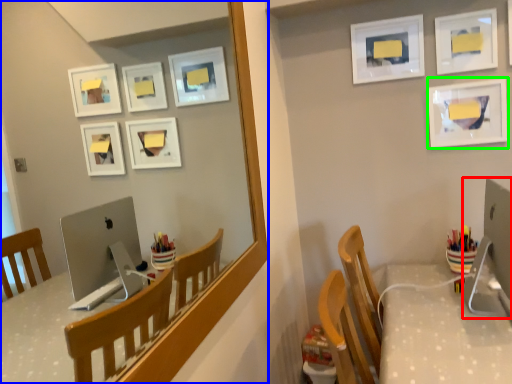
Question: Based on their relative distances, which object is farther from desktop computer (highlighted by a red box)? Choose from mirror (highlighted by a blue box) and picture frame (highlighted by a green box).

Choices:
 (A) mirror
 (B) picture frame

Answer: (A)